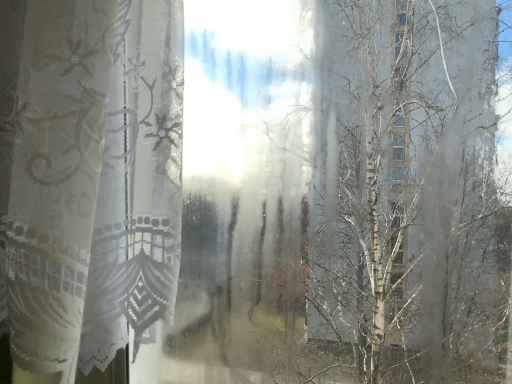
The height and width of the screenshot is (384, 512). I want to click on white lace curtain at left, so click(90, 185).

The image size is (512, 384). Describe the element at coordinates (90, 185) in the screenshot. I see `white lace curtain at left` at that location.

The image size is (512, 384). I want to click on white lace curtain at left, so click(x=90, y=185).